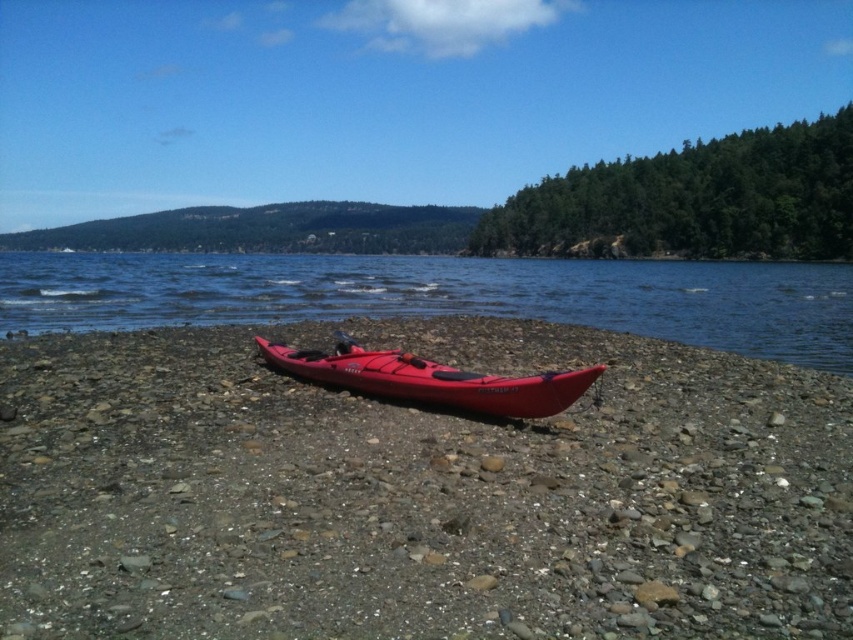
Is point (805, 461) positioned before point (422, 257)?

Yes, it is.

Is matte plastic kayak at center bigger than transparent water at center?

No, matte plastic kayak at center is not bigger than transparent water at center.

The image size is (853, 640). What do you see at coordinates (418, 493) in the screenshot?
I see `matte plastic kayak at center` at bounding box center [418, 493].

Identify the location of matte plastic kayak at center. This screenshot has width=853, height=640. (418, 493).

Between matte plastic kayak at center and matte red canoe at center, which one is positioned higher?

matte red canoe at center is above.

Measure the distance between matte plastic kayak at center and matte red canoe at center.

matte plastic kayak at center is 5.24 feet from matte red canoe at center.

What do you see at coordinates (418, 493) in the screenshot? I see `matte plastic kayak at center` at bounding box center [418, 493].

You are a GUI agent. You are given a task and a screenshot of the screen. Output one action in this format:
    pyautogui.click(x=<x>, y=<y>)
    Task: Click on the matte plastic kayak at center
    
    Given the screenshot: What is the action you would take?
    pyautogui.click(x=418, y=493)

Who is shorter, transparent water at center or matte red canoe at center?

With less height is matte red canoe at center.

Is transparent water at center below matte red canoe at center?

No, transparent water at center is not below matte red canoe at center.

Does point (135, 272) come farther from viewer compared to point (476, 394)?

Yes, point (135, 272) is farther from viewer.

Where is `transparent water at center`? This screenshot has height=640, width=853. transparent water at center is located at coordinates (444, 296).